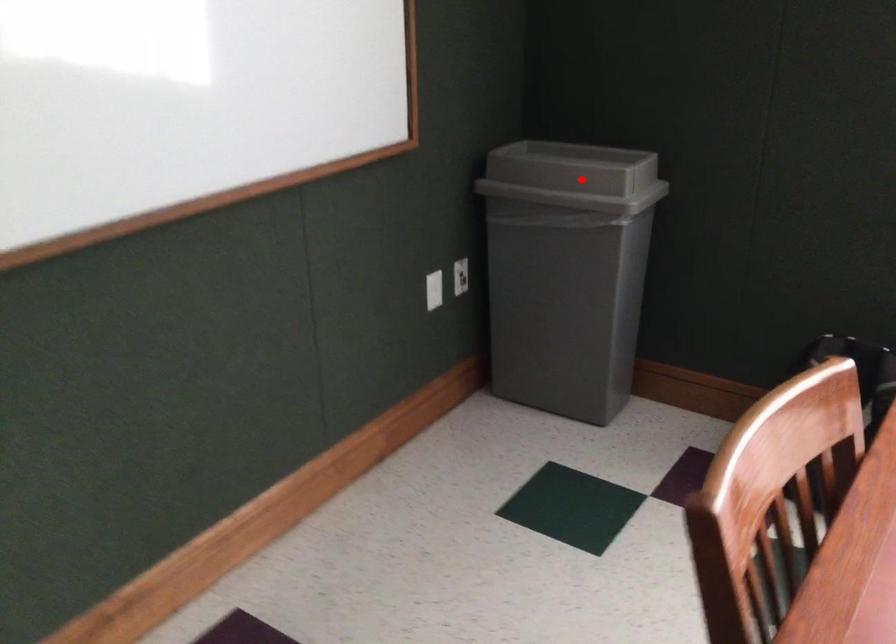
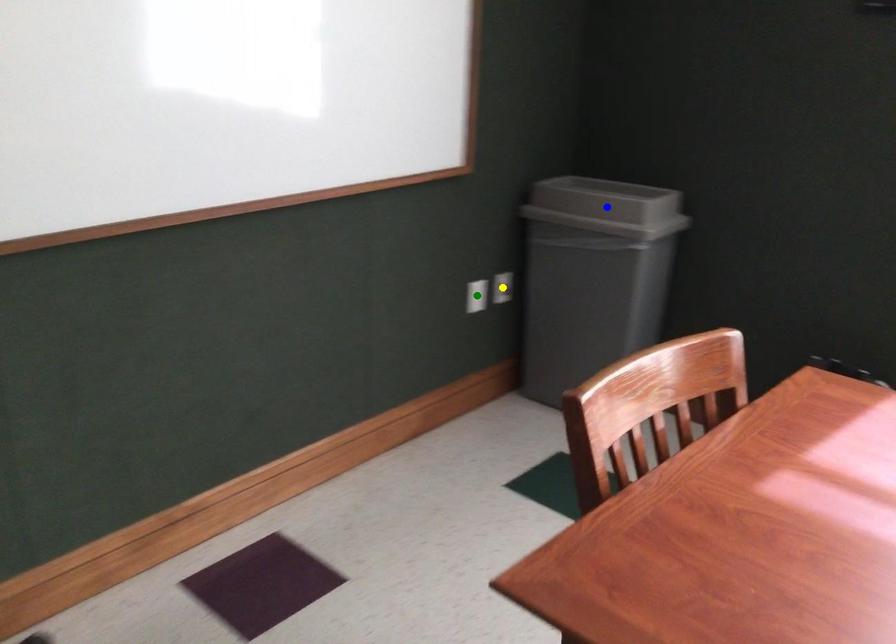
Question: I am providing you with two images of the same scene from different viewpoints. A red point is marked on the first image. You are given multiple points on the second image. Can you choose the point in image 2 that corresponds to the point in image 1?

Choices:
 (A) yellow point
 (B) green point
 (C) blue point

Answer: (C)